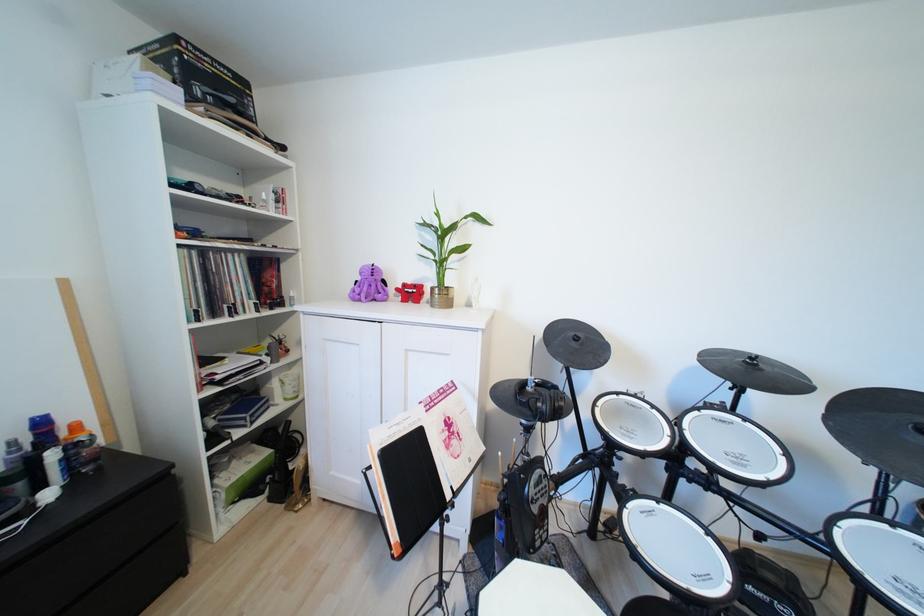
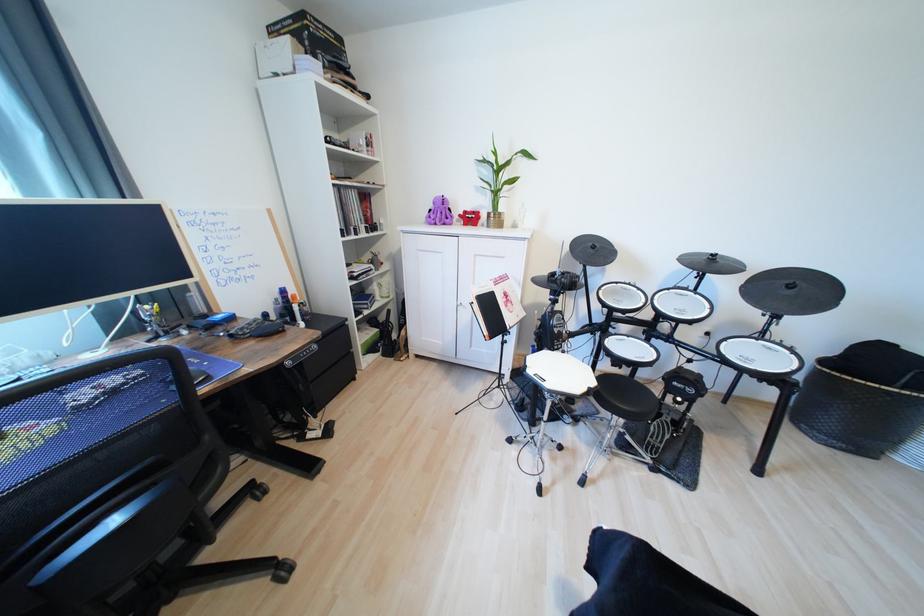
Question: In a continuous first-person perspective shot, in which direction is the camera moving?

Choices:
 (A) Left
 (B) Right
 (C) Forward
 (D) Backward

Answer: (D)